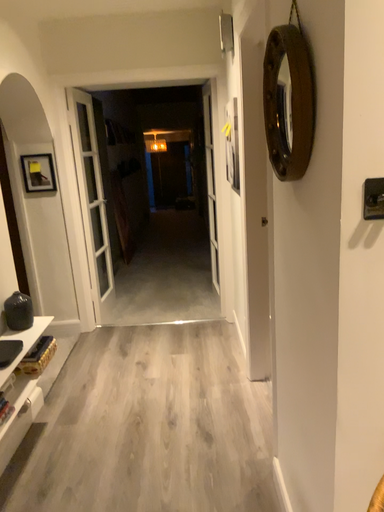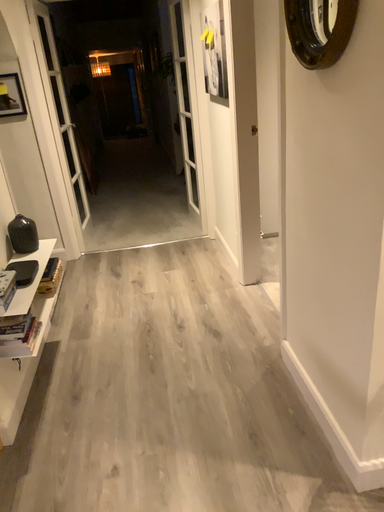
Question: How did the camera likely rotate when shooting the video?

Choices:
 (A) rotated left
 (B) rotated right

Answer: (B)